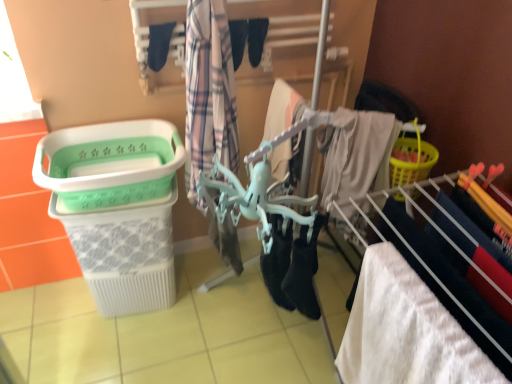
Question: Is green plastic laundry basket at left inside or outside of black fabric shoe at center, placed as the 1th shoe when sorted from left to right?

Choices:
 (A) outside
 (B) inside

Answer: (A)

Question: Looking at their shapes, would you say green plastic laundry basket at left is wider or thinner than black fabric shoe at center, placed as the 1th shoe when sorted from left to right?

Choices:
 (A) wide
 (B) thin

Answer: (A)

Question: Estimate the real-world distances between objects in this image. Which object is farther from the plaid fabric at center, the first clothing when ordered from right to left?

Choices:
 (A) white fluffy towel at lower right
 (B) green plastic laundry basket at left
 (C) black fabric shoe at center, the 1th shoe viewed from the right
 (D) black fabric shoe at center, placed as the 1th shoe when sorted from left to right
 (E) black fabric socks at upper center, placed as the first clothing when sorted from left to right

Answer: (A)

Question: Estimate the real-world distances between objects in this image. Which object is closer to the green plastic laundry basket at left?

Choices:
 (A) plaid fabric at center, the first clothing when ordered from right to left
 (B) black fabric socks at upper center, which is the 2th clothing in right-to-left order
 (C) black fabric shoe at center, which is the 2th shoe in left-to-right order
 (D) green plastic laundry basket at left
 (E) white fluffy towel at lower right

Answer: (D)